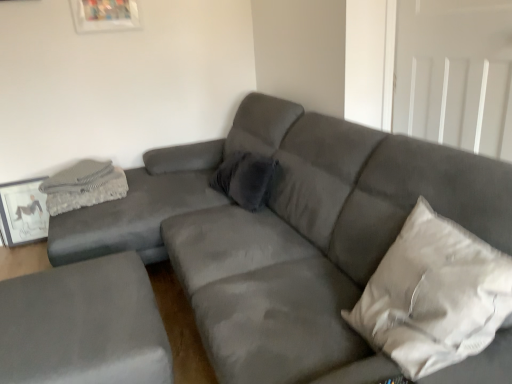
Question: In terms of height, does white fabric pillow at right, the 1th pillow from the front, look taller or shorter compared to gray textured blanket at upper left?

Choices:
 (A) tall
 (B) short

Answer: (A)

Question: Considering the positions of white fabric pillow at right, the second pillow positioned from the back, and gray textured blanket at upper left in the image, is white fabric pillow at right, the second pillow positioned from the back, wider or thinner than gray textured blanket at upper left?

Choices:
 (A) thin
 (B) wide

Answer: (A)

Question: Estimate the real-world distances between objects in this image. Which object is closer to the matte gray picture frame at left?

Choices:
 (A) gray textured blanket at upper left
 (B) suede gray couch at center, the second studio couch when ordered from left to right
 (C) suede gray ottoman at lower left, marked as the 2th studio couch in a right-to-left arrangement
 (D) white fabric pillow at right, the first pillow when ordered from right to left
 (E) velvet gray pillow at center, positioned as the second pillow in front-to-back order

Answer: (A)

Question: Estimate the real-world distances between objects in this image. Which object is closer to the suede gray couch at center, positioned as the first studio couch in right-to-left order?

Choices:
 (A) suede gray ottoman at lower left, the 1th studio couch viewed from the left
 (B) matte gray picture frame at left
 (C) gray textured blanket at upper left
 (D) white fabric pillow at right, the 2th pillow from the left
 (E) velvet gray pillow at center, positioned as the second pillow in front-to-back order

Answer: (D)